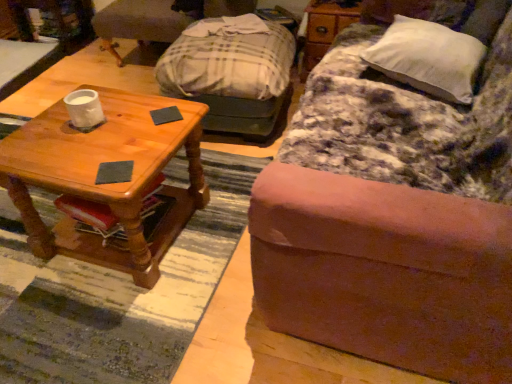
This screenshot has height=384, width=512. What are the coordinates of `vacant area that is situated to the right of white marble cup at center left` in the screenshot? It's located at (131, 119).